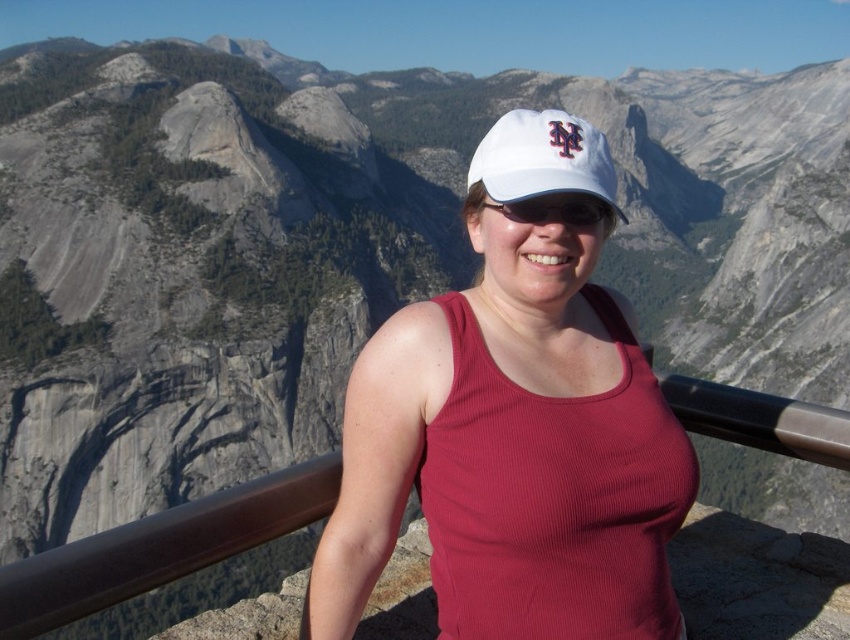
Question: Is white matte baseball cap at center thinner than white matte cap at center?

Choices:
 (A) yes
 (B) no

Answer: (B)

Question: Does white matte baseball cap at center have a larger size compared to white fabric cap at center?

Choices:
 (A) yes
 (B) no

Answer: (A)

Question: Which point is farther from the camera taking this photo?

Choices:
 (A) (592, 211)
 (B) (588, 189)

Answer: (A)

Question: Which of the following is the closest to the observer?

Choices:
 (A) (575, 198)
 (B) (459, 499)
 (C) (586, 182)

Answer: (B)

Question: In this image, where is white fabric cap at center located relative to white matte cap at center?

Choices:
 (A) above
 (B) below

Answer: (A)

Question: Which point appears farthest from the camera in this image?

Choices:
 (A) click(500, 163)
 (B) click(573, 211)
 (C) click(548, 128)

Answer: (B)